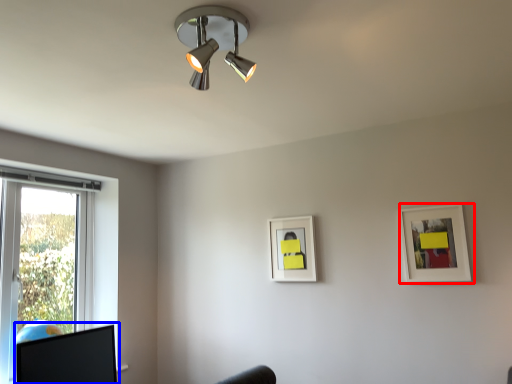
Question: Which point is further to the camera, picture frame (highlighted by a red box) or computer monitor (highlighted by a blue box)?

Choices:
 (A) picture frame
 (B) computer monitor

Answer: (A)